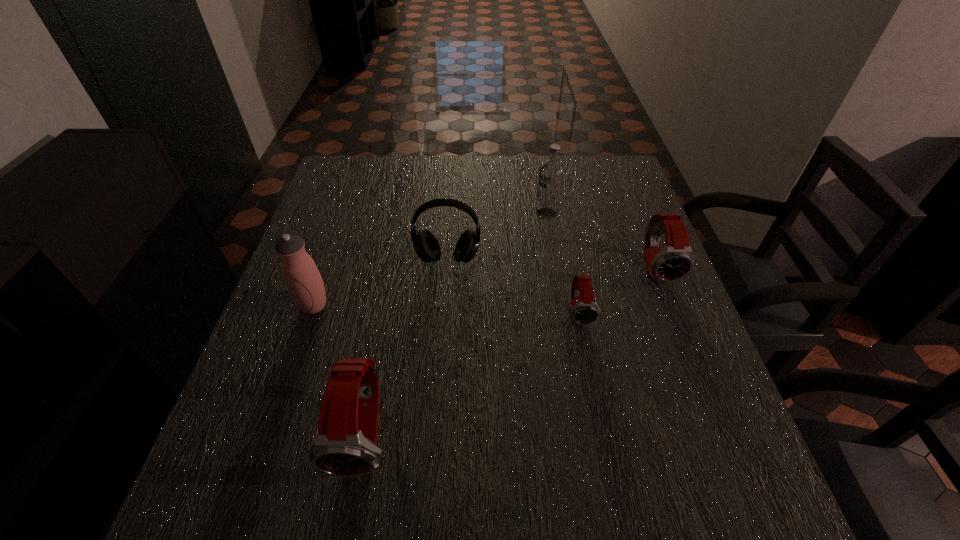
Where is `the nearest watch`? Image resolution: width=960 pixels, height=540 pixels. the nearest watch is located at coordinates (345, 445).

You are a GUI agent. You are given a task and a screenshot of the screen. Output one action in this format:
    pyautogui.click(x=<x>, y=<y>)
    Task: Click on the nearest object
    This screenshot has height=540, width=960.
    Given the screenshot: What is the action you would take?
    pyautogui.click(x=345, y=445)

Find the location of a particular element. This screenshot has width=960, height=540. the second nearest watch is located at coordinates (585, 311).

Locate an element on the screen. The width and height of the screenshot is (960, 540). the shortest watch is located at coordinates (585, 311).

This screenshot has width=960, height=540. I want to click on the rightmost watch, so click(676, 260).

I want to click on the second shortest watch, so click(x=676, y=260).

Where is `headset`? Image resolution: width=960 pixels, height=540 pixels. headset is located at coordinates (426, 246).

I want to click on thermos bottle, so click(303, 280).

You are a GUI agent. You are given a task and a screenshot of the screen. Output one action in this format:
    pyautogui.click(x=<x>, y=<y>)
    Task: Click on the vodka
    This screenshot has width=960, height=540.
    Given the screenshot: What is the action you would take?
    pyautogui.click(x=551, y=173)

The image size is (960, 540). Identify the location of free location located on the face of the shortest watch. (594, 386).